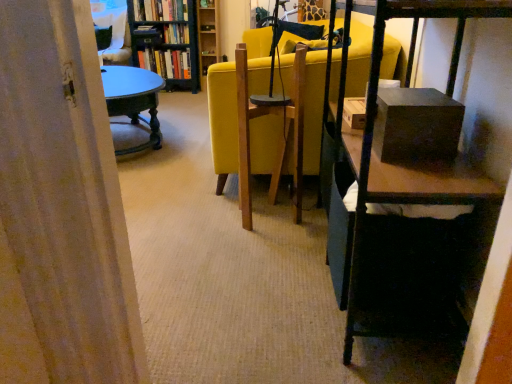
Question: Is wooden bookshelf at upper center to the left of wooden bookshelf at upper left from the viewer's perspective?

Choices:
 (A) no
 (B) yes

Answer: (A)

Question: Considering the relative sizes of wooden bookshelf at upper center and wooden bookshelf at upper left in the image provided, is wooden bookshelf at upper center thinner than wooden bookshelf at upper left?

Choices:
 (A) no
 (B) yes

Answer: (B)

Question: Would you say wooden bookshelf at upper left is part of wooden bookshelf at upper center's contents?

Choices:
 (A) no
 (B) yes

Answer: (A)

Question: Is wooden bookshelf at upper center further to camera compared to wooden bookshelf at upper left?

Choices:
 (A) no
 (B) yes

Answer: (B)

Question: Can you confirm if wooden bookshelf at upper center is bigger than wooden bookshelf at upper left?

Choices:
 (A) no
 (B) yes

Answer: (A)

Question: From the image's perspective, is hardcover book at upper left, positioned as the 3th book in top-to-bottom order, located above or below hardcover book at center, the 2th book in the top-to-bottom sequence?

Choices:
 (A) below
 (B) above

Answer: (A)

Question: Do you think hardcover book at upper left, positioned as the 3th book in top-to-bottom order, is within hardcover book at center, placed as the 2th book when sorted from bottom to top, or outside of it?

Choices:
 (A) outside
 (B) inside

Answer: (A)

Question: From a real-world perspective, is hardcover book at upper left, positioned as the 3th book in top-to-bottom order, positioned above or below hardcover book at center, placed as the 2th book when sorted from bottom to top?

Choices:
 (A) above
 (B) below

Answer: (B)

Question: In terms of size, does hardcover book at upper left, positioned as the 3th book in top-to-bottom order, appear bigger or smaller than hardcover book at center, placed as the 2th book when sorted from bottom to top?

Choices:
 (A) big
 (B) small

Answer: (A)

Question: In the image, is hardcover books at upper left, which is the 3th book from bottom to top, on the left side or the right side of hardcover book at center, the 2th book in the top-to-bottom sequence?

Choices:
 (A) right
 (B) left

Answer: (B)

Question: Is hardcover books at upper left, placed as the 1th book when sorted from top to bottom, in front of or behind hardcover book at center, the 2th book in the top-to-bottom sequence, in the image?

Choices:
 (A) front
 (B) behind

Answer: (A)

Question: From a real-world perspective, is hardcover books at upper left, placed as the 1th book when sorted from top to bottom, physically located above or below hardcover book at center, the 2th book in the top-to-bottom sequence?

Choices:
 (A) below
 (B) above

Answer: (B)

Question: Is hardcover books at upper left, which is the 3th book from bottom to top, taller or shorter than hardcover book at center, the 2th book in the top-to-bottom sequence?

Choices:
 (A) tall
 (B) short

Answer: (A)

Question: Considering their positions, is hardcover book at center, placed as the 2th book when sorted from bottom to top, located in front of or behind hardcover book at upper left, positioned as the 3th book in top-to-bottom order?

Choices:
 (A) front
 (B) behind

Answer: (A)

Question: From the image's perspective, is hardcover book at center, placed as the 2th book when sorted from bottom to top, above or below hardcover book at upper left, positioned as the 3th book in top-to-bottom order?

Choices:
 (A) above
 (B) below

Answer: (A)